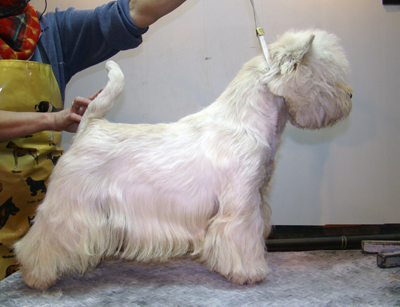
This screenshot has height=307, width=400. In order to click on wall in this screenshot , I will do pyautogui.click(x=190, y=74).